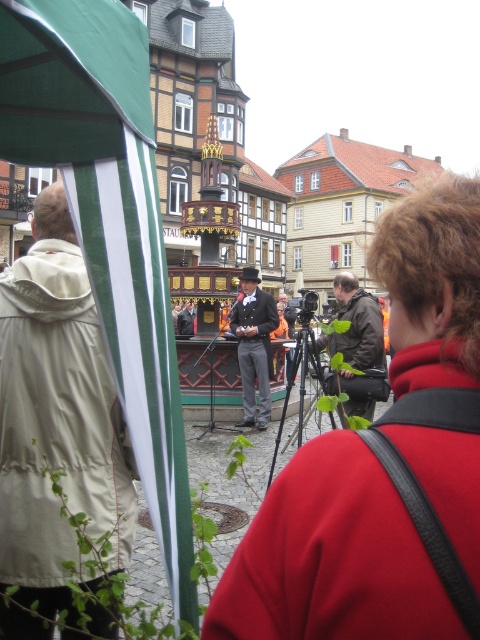
Can you confirm if matte black coat at center is smaller than beige/waterproof jacket at left?

Incorrect, matte black coat at center is not smaller in size than beige/waterproof jacket at left.

Can you confirm if matte black coat at center is positioned to the right of beige/waterproof jacket at left?

Correct, you'll find matte black coat at center to the right of beige/waterproof jacket at left.

Between point (282, 531) and point (36, 371), which one is positioned in front?

Point (282, 531) is more forward.

This screenshot has height=640, width=480. In order to click on matte black coat at center in this screenshot , I will do `click(384, 465)`.

Who is taller, green fabric canopy at left or shiny black suit at center?

With more height is green fabric canopy at left.

You are a GUI agent. You are given a task and a screenshot of the screen. Output one action in this format:
    pyautogui.click(x=<x>, y=<y>)
    Task: Click on the green fabric canopy at left
    
    Given the screenshot: What is the action you would take?
    pyautogui.click(x=108, y=221)

Locate an element on the screen. Image resolution: width=480 pixels, height=640 pixels. green fabric canopy at left is located at coordinates (108, 221).

Can you confirm if matte black coat at center is positioned above shiny black suit at center?

No, matte black coat at center is not above shiny black suit at center.

Who is more distant from viewer, (345, 589) or (248, 310)?

Point (248, 310)

The image size is (480, 640). What do you see at coordinates (384, 465) in the screenshot? I see `matte black coat at center` at bounding box center [384, 465].

The width and height of the screenshot is (480, 640). In order to click on matte black coat at center in this screenshot , I will do `click(384, 465)`.